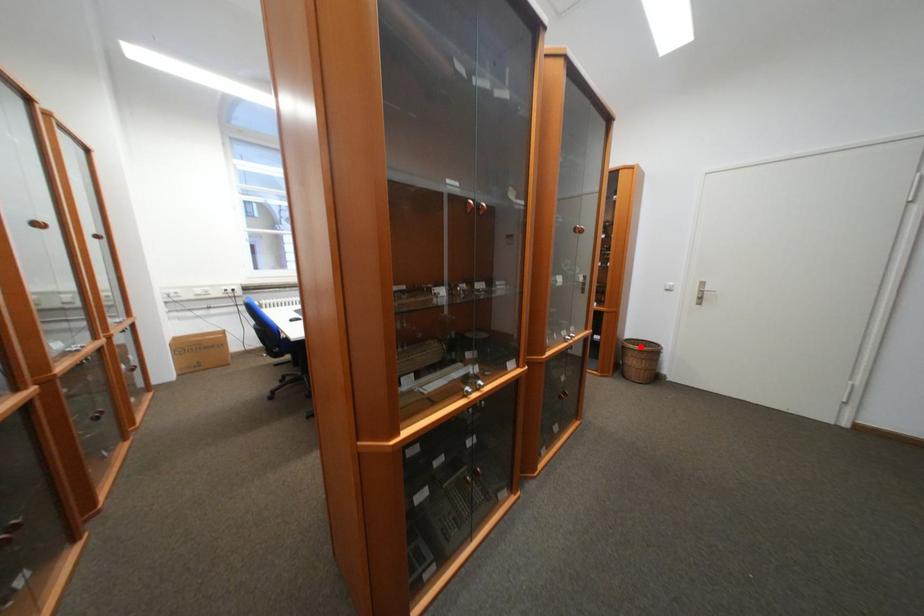
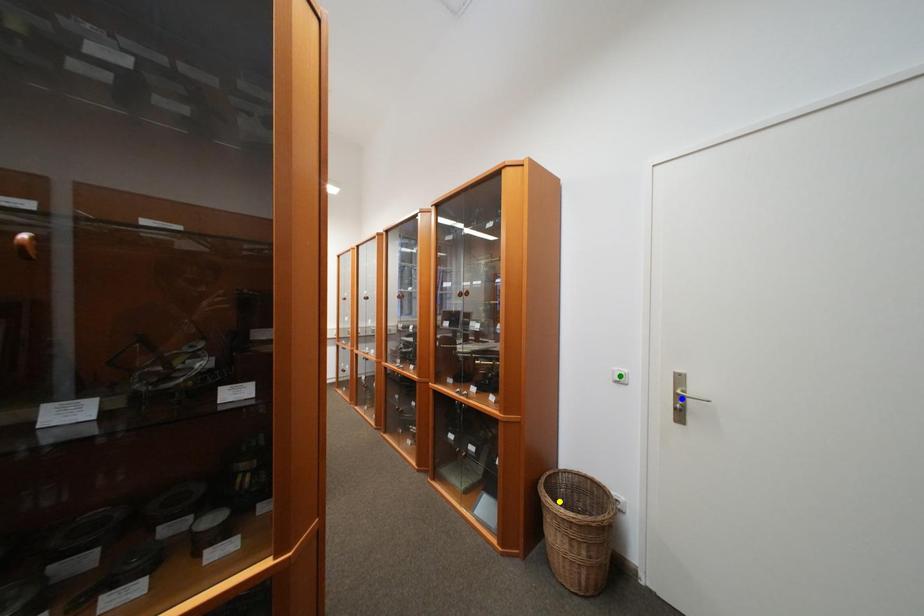
Question: I am providing you with two images of the same scene from different viewpoints. A red point is marked on the first image. You are given multiple points on the second image. Which mark in image 2 goes with the point in image 1?

Choices:
 (A) green point
 (B) blue point
 (C) yellow point

Answer: (C)